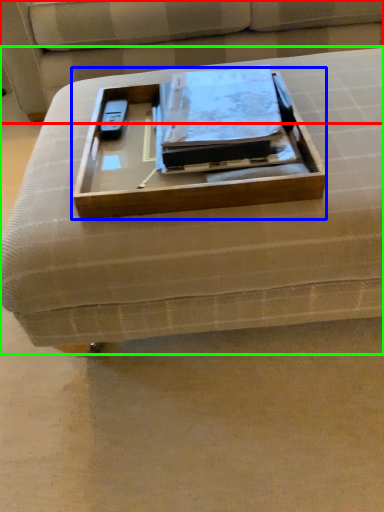
Question: Which object is positioned farthest from couch (highlighted by a red box)? Select from box (highlighted by a blue box) and furniture (highlighted by a green box).

Choices:
 (A) box
 (B) furniture

Answer: (B)